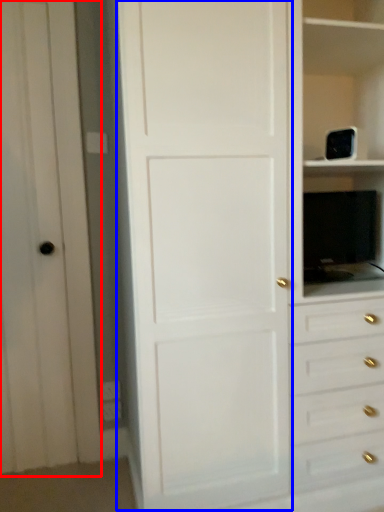
Question: Which object appears closest to the camera in this image, glass door (highlighted by a red box) or door (highlighted by a blue box)?

Choices:
 (A) glass door
 (B) door

Answer: (B)